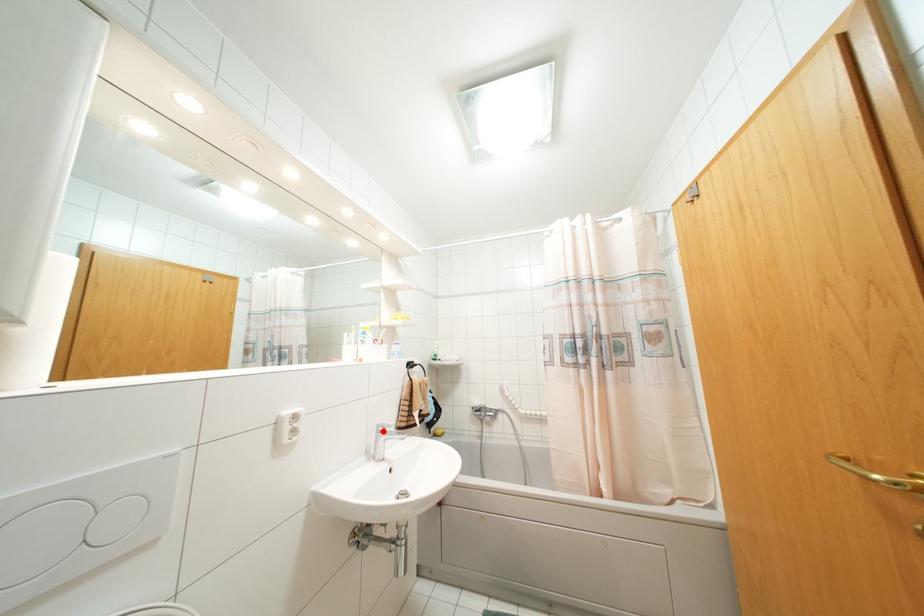
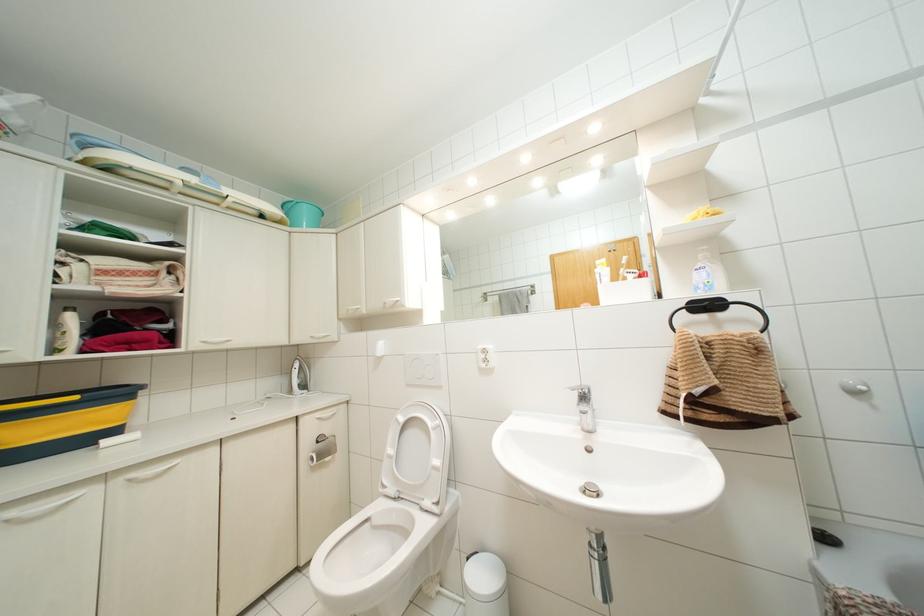
The point at the highlighted location is marked in the first image. Where is the corresponding point in the second image?

(584, 395)